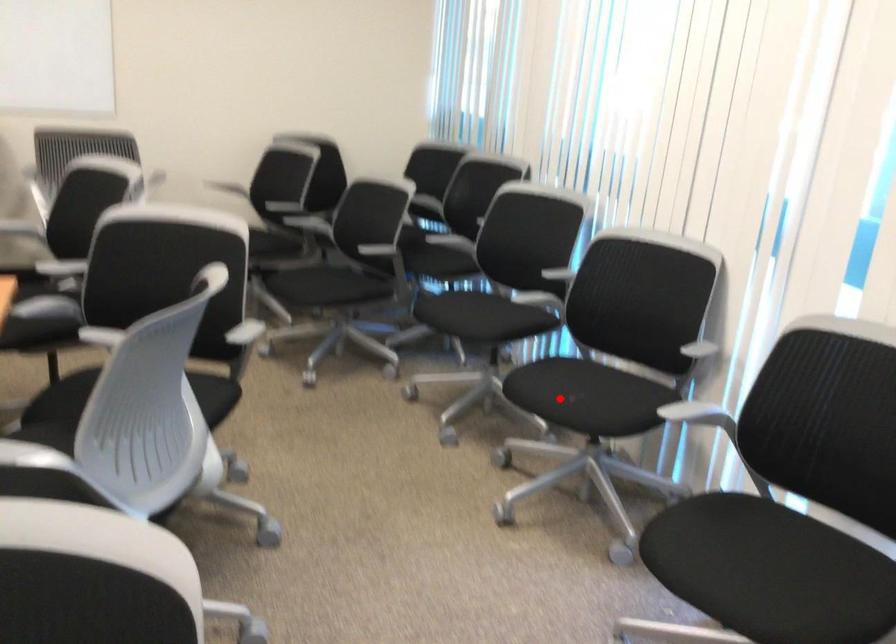
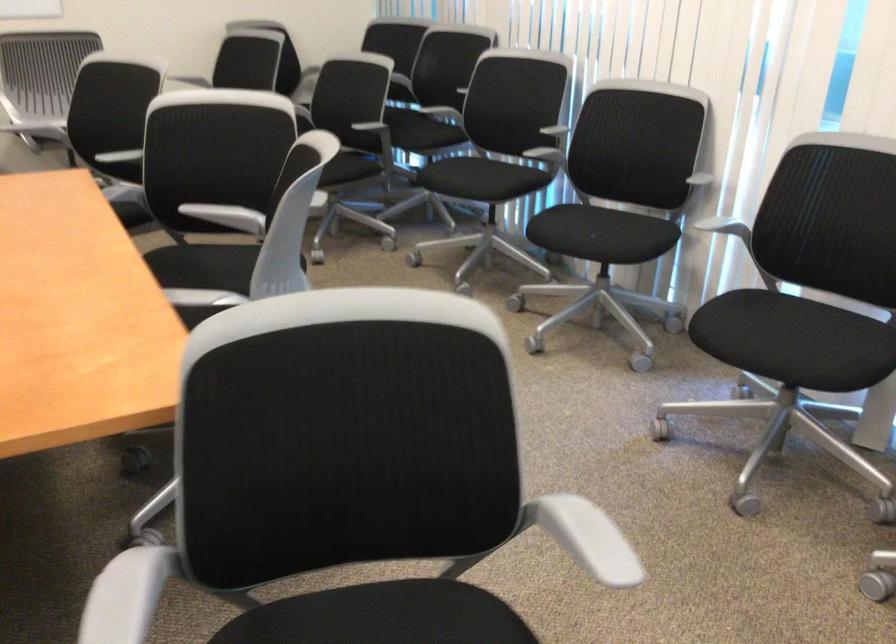
The point at the highlighted location is marked in the first image. Where is the corresponding point in the second image?

(582, 232)